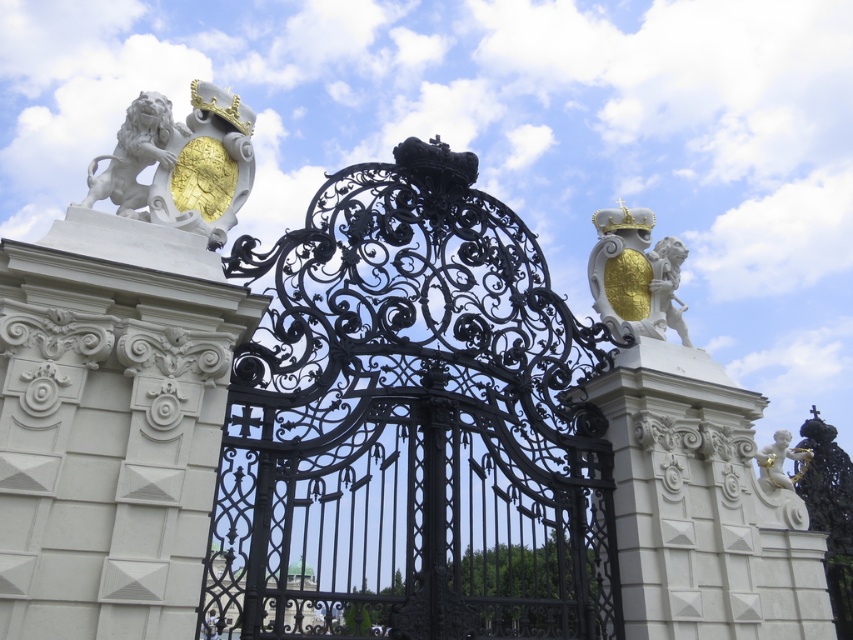
The image size is (853, 640). Find the location of `white marble lion at upper left`. white marble lion at upper left is located at coordinates (134, 154).

Is point (143, 136) more distant than point (799, 449)?

No.

Who is more forward, (149, 125) or (763, 464)?

Point (149, 125)

Image resolution: width=853 pixels, height=640 pixels. I want to click on white marble lion at upper left, so click(134, 154).

Can you confirm if white stone lion at upper left is bigger than white marble lion at upper left?

Yes.

What are the coordinates of `white stone lion at upper left` in the screenshot? It's located at (181, 163).

Where is `white stone lion at upper left`? This screenshot has height=640, width=853. white stone lion at upper left is located at coordinates (181, 163).

Between white stone lion at upper left and gold textured shield with cherub at upper right, which one has less height?

white stone lion at upper left

What do you see at coordinates (181, 163) in the screenshot?
I see `white stone lion at upper left` at bounding box center [181, 163].

Identify the location of white stone lion at upper left. (181, 163).